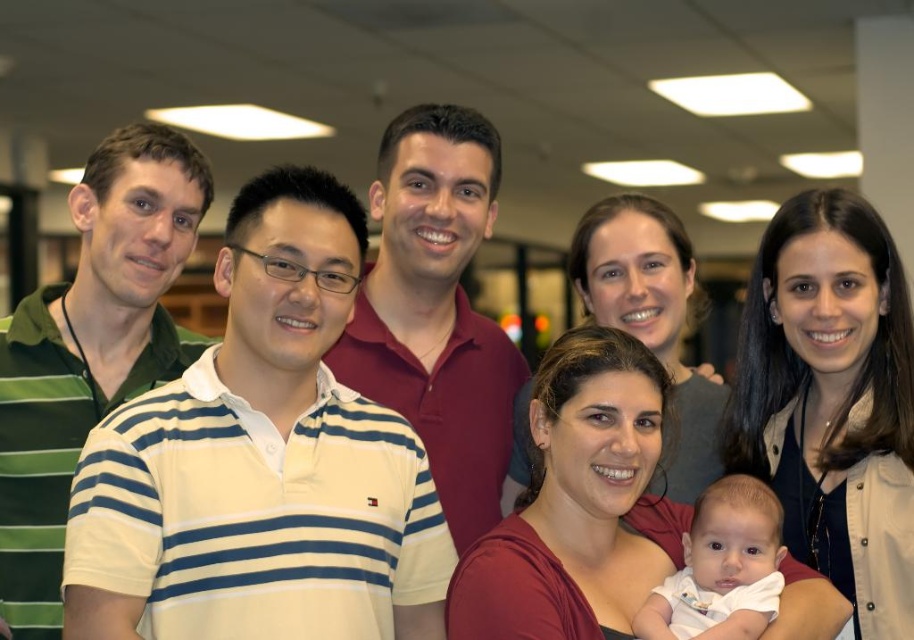
You are organizing a group photo and need to ensure everyone fits within a 2m wide frame. The green striped polo shirt at left and the white soft baby at center are the two widest individuals. Can both fit side by side within the frame?

The green striped polo shirt at left is wider than the white soft baby at center. Since both are the widest individuals, their combined width would exceed the 2m frame. Therefore, they cannot fit side by side within the frame.

You are a photographer standing in front of the group. You need to take a photo of the white soft baby at center and the green striped polo shirt at left. Which one should you focus on first if you want to capture both in the same frame without moving the camera?

You should focus on the green striped polo shirt at left first because it is closer to the camera than the white soft baby at center, allowing both to be in the same frame without moving the camera.

You are a tailor measuring the distance between two shirts for a fitting. The shirts are the striped cotton polo shirt at center and the maroon cotton polo shirt at center. Can you fit a 12 inch ruler between them?

The striped cotton polo shirt at center and maroon cotton polo shirt at center are 16.30 inches apart from each other, so yes, a 12 inch ruler can fit between them since the distance is greater than the ruler length.